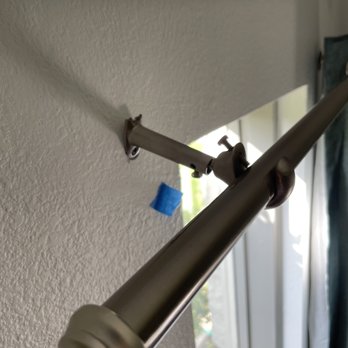
Locate an element on the screen. The image size is (348, 348). hook is located at coordinates (277, 182).